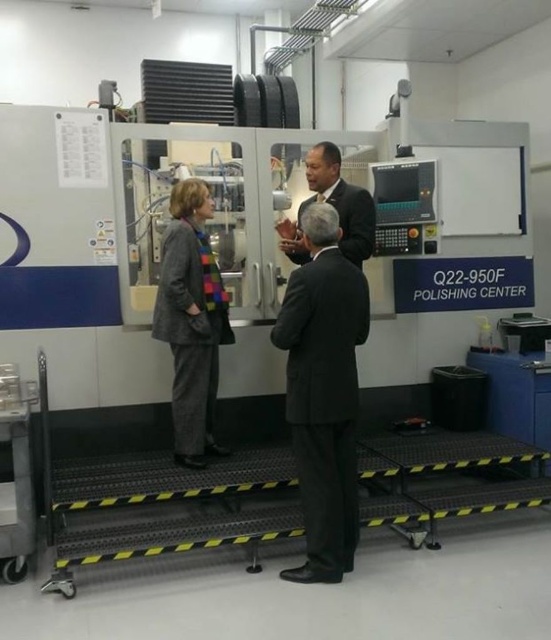
Does point (196, 424) come closer to viewer compared to point (294, 225)?

Yes, it is.

Does point (188, 424) come behind point (305, 205)?

No.

Image resolution: width=551 pixels, height=640 pixels. What are the coordinates of `gray woolen blazer at center` in the screenshot? It's located at (191, 321).

Does point (326, 461) come in front of point (366, 227)?

Yes, it is in front of point (366, 227).

Is point (315, 317) positioned behind point (299, 218)?

No, (315, 317) is closer to viewer.

You are a GUI agent. You are given a task and a screenshot of the screen. Output one action in this format:
    pyautogui.click(x=<x>, y=<y>)
    Task: Click on the black suit at center
    The width and height of the screenshot is (551, 640).
    Given the screenshot: What is the action you would take?
    pyautogui.click(x=323, y=392)

Is the position of black suit at center more distant than that of gray woolen blazer at center?

No, black suit at center is closer to the viewer.

Who is more distant from viewer, (306, 474) or (171, 339)?

The point (171, 339) is behind.

Locate an element on the screen. This screenshot has width=551, height=640. black suit at center is located at coordinates (323, 392).